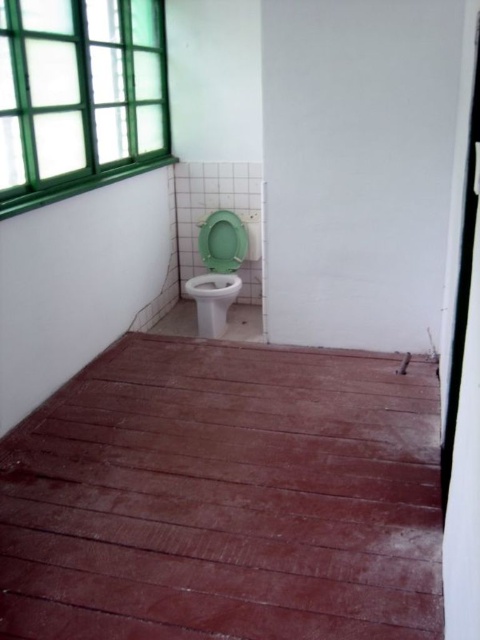
You are standing at point [216,317] and want to move to the toilet with a green seat and lid in the corner of the restroom. Can you walk directly to the toilet without passing through point [4,56]?

Point [4,56] is in front of point [216,317], so you would have to pass through point [4,56] to reach the toilet with a green seat and lid in the corner of the restroom.

You are standing in the restroom and want to look out the green glass window at upper left. To do so, where should you position yourself relative to the green plastic toilet bowl at center?

You should stand facing the green glass window at upper left, which is positioned over the green plastic toilet bowl at center, so standing in front of the toilet bowl would place you facing the window.